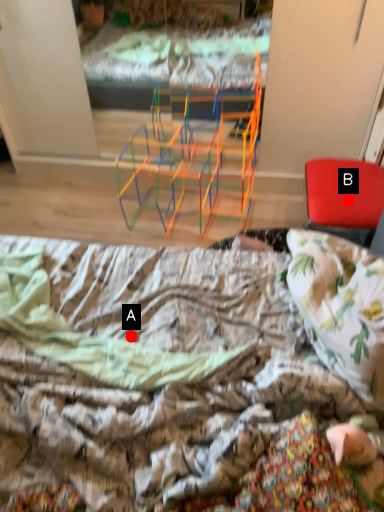
Question: Two points are circled on the image, labeled by A and B beside each circle. Among these points, which one is nearest to the camera?

Choices:
 (A) A is closer
 (B) B is closer

Answer: (A)